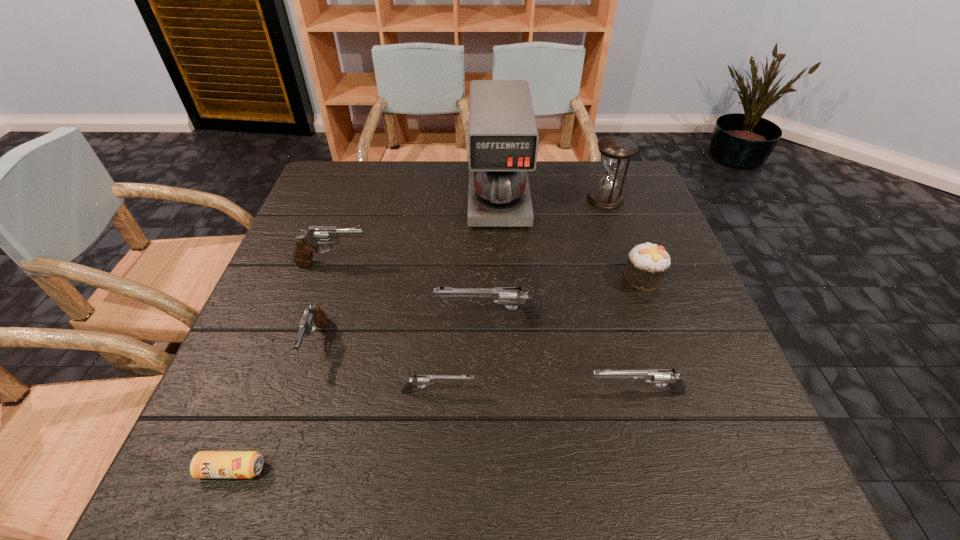
Locate an element on the screen. hourglass that is at the right edge is located at coordinates (616, 150).

You are a GUI agent. You are given a task and a screenshot of the screen. Output one action in this format:
    pyautogui.click(x=<x>, y=<y>)
    Task: Click on the cupcake located in the right edge section of the desktop
    
    Given the screenshot: What is the action you would take?
    pyautogui.click(x=647, y=263)

The width and height of the screenshot is (960, 540). I want to click on pistol situated at the right edge, so click(668, 377).

I want to click on object at the near left corner, so click(205, 464).

The width and height of the screenshot is (960, 540). Find the location of `object that is at the far right corner`. object that is at the far right corner is located at coordinates (616, 150).

In the image, there is a desktop. Identify the location of blank space at the far edge. (557, 205).

Identify the location of free space at the left edge. This screenshot has height=540, width=960. (248, 417).

This screenshot has width=960, height=540. In the image, there is a desktop. What are the coordinates of `free space at the right edge` in the screenshot? It's located at (651, 327).

In the image, there is a desktop. Where is `free space at the far left corner`? This screenshot has height=540, width=960. free space at the far left corner is located at coordinates (348, 197).

You are a GUI agent. You are given a task and a screenshot of the screen. Output one action in this format:
    pyautogui.click(x=<x>, y=<y>)
    Task: Click on the free location at the near left corner of the desktop
    The image size is (960, 540).
    Given the screenshot: What is the action you would take?
    pos(200,448)